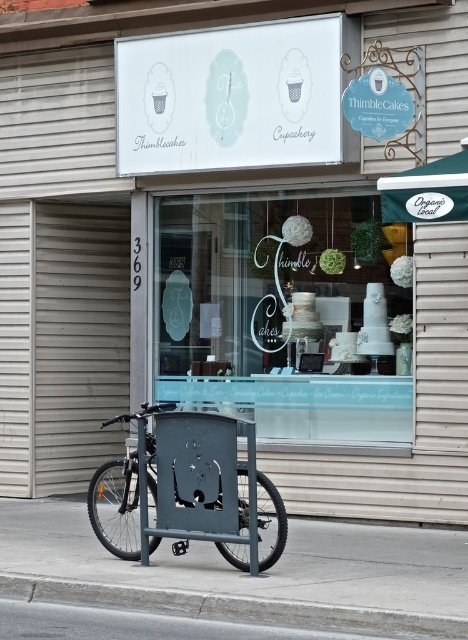
Question: Estimate the real-world distances between objects in this image. Which object is farther from the metallic bicycle at lower left?

Choices:
 (A) clear glass window at center
 (B) black rubber wheel at lower left
 (C) gray concrete pavement at lower left

Answer: (A)

Question: Which object is the farthest from the black rubber wheel at lower left?

Choices:
 (A) clear glass window at center
 (B) gray concrete curb at lower left

Answer: (A)

Question: Is gray concrete curb at lower left further to camera compared to black rubber wheel at lower left?

Choices:
 (A) yes
 (B) no

Answer: (B)

Question: Which point is farther from the camera taking this photo?

Choices:
 (A) (263, 538)
 (B) (118, 465)
 (C) (378, 548)

Answer: (A)

Question: Is gray concrete curb at lower left wider than metallic bicycle at lower left?

Choices:
 (A) yes
 (B) no

Answer: (A)

Question: Observing the image, what is the correct spatial positioning of clear glass window at center in reference to black rubber wheel at lower left?

Choices:
 (A) below
 (B) above

Answer: (B)